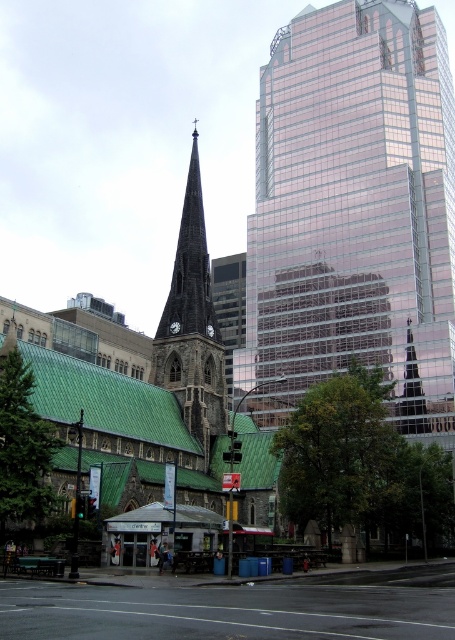
Is glassy reflective skyscraper at center to the left of dark brown wooden spire at center from the viewer's perspective?

Incorrect, glassy reflective skyscraper at center is not on the left side of dark brown wooden spire at center.

Between glassy reflective skyscraper at center and dark brown wooden spire at center, which one appears on the right side from the viewer's perspective?

glassy reflective skyscraper at center is more to the right.

Between point (268, 193) and point (185, 365), which one is positioned in front?

Positioned in front is point (185, 365).

Find the location of a particular element. glassy reflective skyscraper at center is located at coordinates (353, 205).

Does glassy reflective skyscraper at center come in front of shiny glass spire at center?

Yes.

Who is positioned more to the right, glassy reflective skyscraper at center or shiny glass spire at center?

Positioned to the right is shiny glass spire at center.

Describe the element at coordinates (353, 205) in the screenshot. The image size is (455, 640). I see `glassy reflective skyscraper at center` at that location.

What are the coordinates of `glassy reflective skyscraper at center` in the screenshot? It's located at (353, 205).

Is the position of green slate roof at center more distant than that of shiny glass spire at center?

No.

Does green slate roof at center have a smaller size compared to shiny glass spire at center?

Actually, green slate roof at center might be larger than shiny glass spire at center.

Who is more distant from viewer, (124, 420) or (407, 384)?

Positioned behind is point (407, 384).

Image resolution: width=455 pixels, height=640 pixels. What are the coordinates of `green slate roof at center` in the screenshot? It's located at (137, 396).